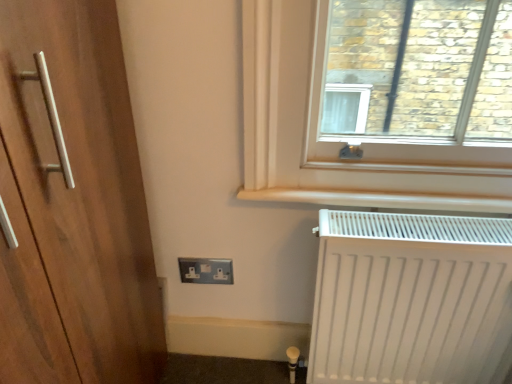
The height and width of the screenshot is (384, 512). What do you see at coordinates (206, 270) in the screenshot?
I see `black plastic outlet at lower center` at bounding box center [206, 270].

Locate an element on the screen. The height and width of the screenshot is (384, 512). black plastic outlet at lower center is located at coordinates (206, 270).

This screenshot has width=512, height=384. What do you see at coordinates (411, 299) in the screenshot?
I see `white matte radiator at lower right` at bounding box center [411, 299].

Locate an element on the screen. Image resolution: width=512 pixels, height=384 pixels. white matte radiator at lower right is located at coordinates (411, 299).

What is the approximate width of white matte radiator at lower right?

white matte radiator at lower right is 4.14 inches wide.

Find the location of a particular element. black plastic outlet at lower center is located at coordinates (206, 270).

Is black plastic outlet at lower center to the right of white matte radiator at lower right from the viewer's perspective?

No.

Does black plastic outlet at lower center lie behind white matte radiator at lower right?

That is True.

Does point (231, 265) lie in front of point (445, 231)?

No, it is not.

From the image's perspective, which one is positioned lower, black plastic outlet at lower center or white matte radiator at lower right?

white matte radiator at lower right.

From a real-world perspective, is black plastic outlet at lower center positioned above or below white matte radiator at lower right?

From a real-world perspective, black plastic outlet at lower center is physically below white matte radiator at lower right.

In terms of width, does black plastic outlet at lower center look wider or thinner when compared to white matte radiator at lower right?

black plastic outlet at lower center is thinner than white matte radiator at lower right.

Is black plastic outlet at lower center taller or shorter than white matte radiator at lower right?

Considering their sizes, black plastic outlet at lower center has less height than white matte radiator at lower right.

Who is smaller, black plastic outlet at lower center or white matte radiator at lower right?

black plastic outlet at lower center is smaller.

Is black plastic outlet at lower center not inside white matte radiator at lower right?

Yes, black plastic outlet at lower center is located beyond the bounds of white matte radiator at lower right.

Is there a large distance between black plastic outlet at lower center and white matte radiator at lower right?

No.

Is black plastic outlet at lower center looking in the opposite direction of white matte radiator at lower right?

No.

Find the location of a particular element. The image size is (512, 384). radiator in front of the black plastic outlet at lower center is located at coordinates (411, 299).

Would you say white matte radiator at lower right is to the left or to the right of black plastic outlet at lower center in the picture?

white matte radiator at lower right is to the right of black plastic outlet at lower center.

Is white matte radiator at lower right in front of or behind black plastic outlet at lower center in the image?

white matte radiator at lower right is positioned closer to the viewer than black plastic outlet at lower center.

Does point (317, 285) come closer to viewer compared to point (206, 273)?

Yes, point (317, 285) is in front of point (206, 273).

From the image's perspective, between white matte radiator at lower right and black plastic outlet at lower center, who is located below?

From the image's view, white matte radiator at lower right is below.

From a real-world perspective, which is physically below, white matte radiator at lower right or black plastic outlet at lower center?

black plastic outlet at lower center.

Which object is thinner, white matte radiator at lower right or black plastic outlet at lower center?

With smaller width is black plastic outlet at lower center.

Considering the sizes of objects white matte radiator at lower right and black plastic outlet at lower center in the image provided, who is shorter, white matte radiator at lower right or black plastic outlet at lower center?

With less height is black plastic outlet at lower center.

Based on the photo, between white matte radiator at lower right and black plastic outlet at lower center, which one has larger size?

white matte radiator at lower right is bigger.

Is white matte radiator at lower right not inside black plastic outlet at lower center?

Yes.

Would you consider white matte radiator at lower right to be distant from black plastic outlet at lower center?

white matte radiator at lower right is actually quite close to black plastic outlet at lower center.

Is white matte radiator at lower right oriented away from black plastic outlet at lower center?

No, black plastic outlet at lower center is not at the back of white matte radiator at lower right.

Identify the location of radiator above the black plastic outlet at lower center (from a real-world perspective). The height and width of the screenshot is (384, 512). (411, 299).

Image resolution: width=512 pixels, height=384 pixels. I want to click on electric outlet below the white matte radiator at lower right (from a real-world perspective), so click(x=206, y=270).

At what (x,y) coordinates should I click in order to perform the action: click on radiator that appears on the right of black plastic outlet at lower center. Please return your answer as a coordinate pair (x, y). The width and height of the screenshot is (512, 384). Looking at the image, I should click on (411, 299).